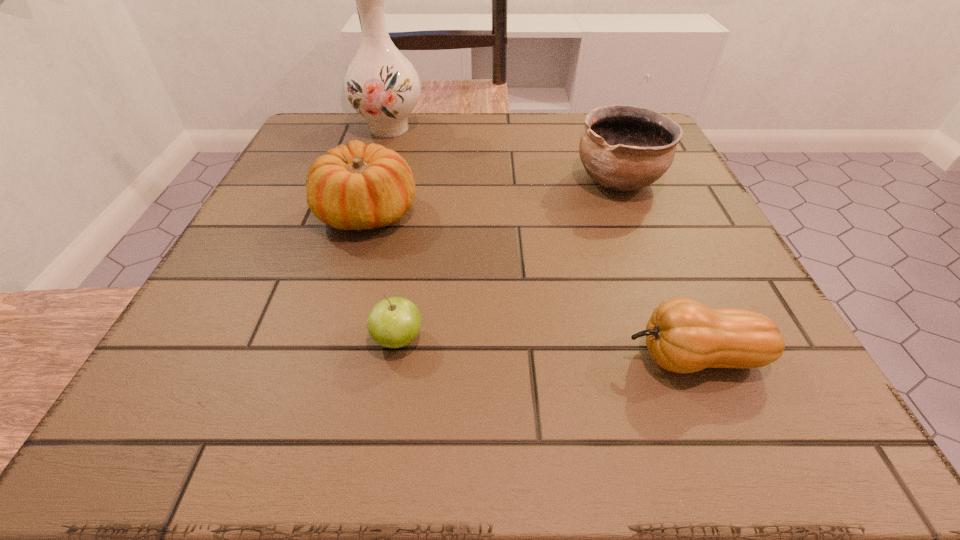
At what (x,y) coordinates should I click in order to perform the action: click on vacant space in between the right gourd and the taller gourd. Please return your answer as a coordinate pair (x, y). Looking at the image, I should click on (531, 285).

I want to click on free area in between the left gourd and the pottery, so click(493, 196).

The image size is (960, 540). Identify the location of empty location between the farther gourd and the shorter gourd. coord(531,285).

I want to click on free spot between the pottery and the nearer gourd, so click(657, 269).

Locate an element on the screen. This screenshot has width=960, height=540. vacant region between the right gourd and the taller gourd is located at coordinates (531, 285).

The image size is (960, 540). I want to click on empty location between the farthest object and the shortest object, so click(394, 234).

You are a GUI agent. You are given a task and a screenshot of the screen. Output one action in this format:
    pyautogui.click(x=<x>, y=<y>)
    Task: Click on the free spot between the tallest object and the shorter gourd
    This screenshot has height=540, width=960.
    Given the screenshot: What is the action you would take?
    pyautogui.click(x=541, y=243)

Identify the location of unoccupied area between the right gourd and the vase. (541, 243).

Identify which object is the nearest to the tallest object. Please provide its 2D coordinates. Your answer should be formatted as a tuple, i.e. [(x, y)], where the tuple contains the x and y coordinates of a point satisfying the conditions above.

[(359, 187)]

In order to click on the second closest object relative to the left gourd in this screenshot , I will do `click(394, 322)`.